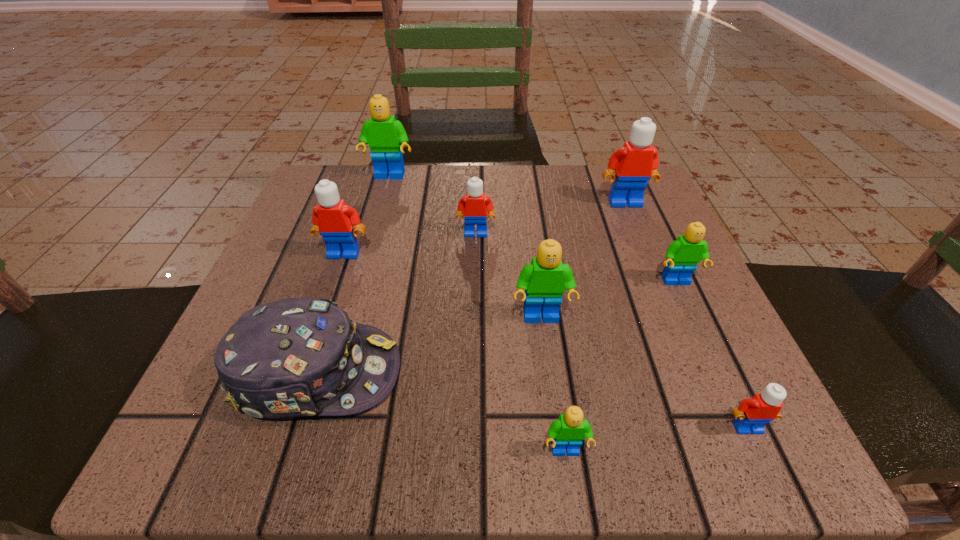
Find the location of a particular element. free spot at the far edge of the desktop is located at coordinates (461, 174).

At what (x,y) coordinates should I click in order to perform the action: click on vacant space at the left edge of the desktop. Please return your answer as a coordinate pair (x, y). Image resolution: width=960 pixels, height=540 pixels. Looking at the image, I should click on (284, 249).

This screenshot has width=960, height=540. What are the coordinates of `vacant space at the right edge` in the screenshot? It's located at (712, 321).

The width and height of the screenshot is (960, 540). I want to click on vacant area at the near left corner of the desktop, so click(204, 448).

Locate an element on the screen. This screenshot has width=960, height=540. vacant point at the far right corner is located at coordinates (589, 219).

I want to click on free spot at the near right corner of the desktop, so click(654, 436).

Where is `free space between the nearest green Lego and the second biggest green Lego`? Image resolution: width=960 pixels, height=540 pixels. free space between the nearest green Lego and the second biggest green Lego is located at coordinates (553, 385).

At what (x,y) coordinates should I click in order to perform the action: click on unoccupied position between the headwear and the farthest green Lego. Please return your answer as a coordinate pair (x, y). Looking at the image, I should click on (354, 275).

The height and width of the screenshot is (540, 960). I want to click on free space between the fifth farthest Lego and the nearest white Lego, so click(711, 355).

Locate an element on the screen. The width and height of the screenshot is (960, 540). free space between the third biggest green Lego and the headwear is located at coordinates (497, 327).